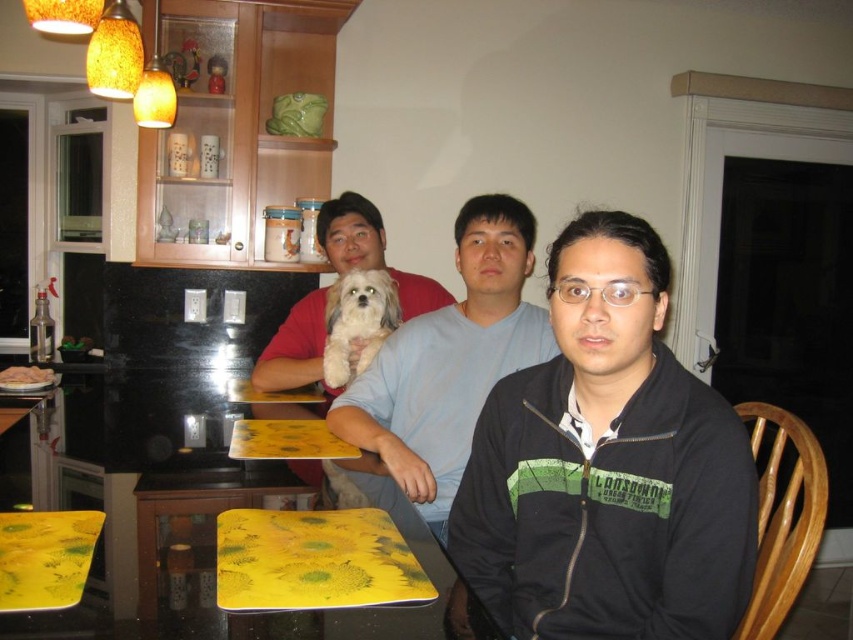
You are a tailor measuring clothes for two people sitting at the dining table. You need to determine which of the two individuals wearing the black matte jacket at center or the light blue cotton shirt at center has a taller torso. Based on the provided scene, which one do you think has a taller torso?

The light blue cotton shirt at center has a greater height than the black matte jacket at center, indicating that the individual wearing it has a taller torso.

You are a photographer setting up a shoot in the dining area. You need to position a camera tripod between the black matte jacket at center and the white fluffy dog at center so that the tripod is equidistant from both. Is this possible given their heights?

The black matte jacket at center is much taller than the white fluffy dog at center. Since the tripod needs to be equidistant from both, the height difference doesn not affect the positioning. The photographer can place the tripod midway between them to achieve equal distance.